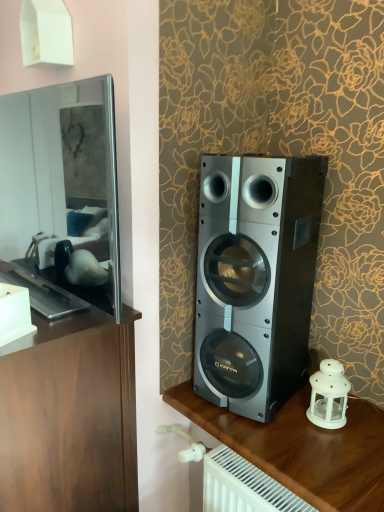
What are the coordinates of `vacant area to the left of white matte lantern at lower right` in the screenshot? It's located at (276, 420).